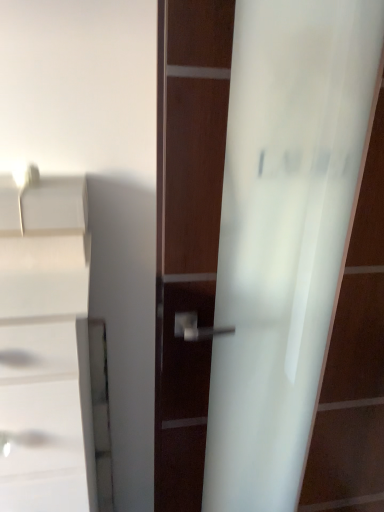
Question: Based on their sizes in the image, would you say white glossy cabinet at left is bigger or smaller than frosted glass door handle at center?

Choices:
 (A) big
 (B) small

Answer: (B)

Question: In terms of width, does white glossy cabinet at left look wider or thinner when compared to frosted glass door handle at center?

Choices:
 (A) wide
 (B) thin

Answer: (A)

Question: Is point (49, 425) positioned closer to the camera than point (246, 314)?

Choices:
 (A) closer
 (B) farther

Answer: (A)

Question: From a real-world perspective, is frosted glass door handle at center positioned above or below white glossy cabinet at left?

Choices:
 (A) below
 (B) above

Answer: (B)

Question: In terms of size, does frosted glass door handle at center appear bigger or smaller than white glossy cabinet at left?

Choices:
 (A) small
 (B) big

Answer: (B)

Question: Considering the positions of point (281, 143) and point (72, 505), is point (281, 143) closer or farther from the camera than point (72, 505)?

Choices:
 (A) closer
 (B) farther

Answer: (A)

Question: In the image, is frosted glass door handle at center on the left side or the right side of white glossy cabinet at left?

Choices:
 (A) left
 (B) right

Answer: (B)